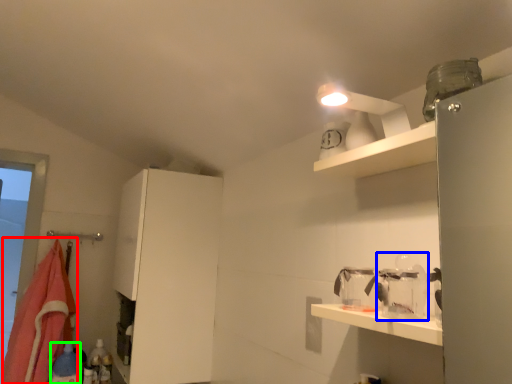
Question: Which object is positioned farthest from blanket (highlighted by a red box)? Select from glass jar (highlighted by a blue box) and bottle (highlighted by a green box).

Choices:
 (A) glass jar
 (B) bottle

Answer: (A)